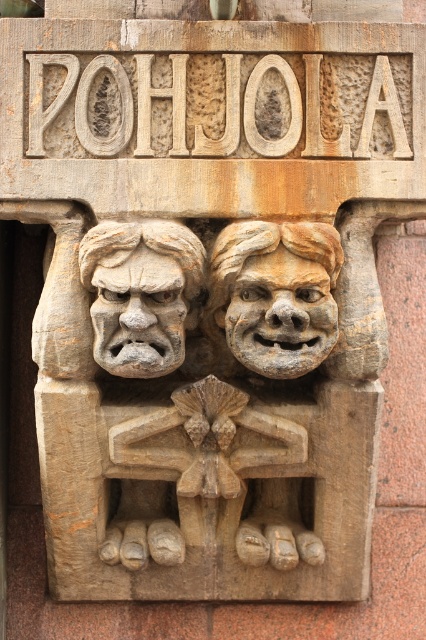
Question: Can you confirm if carved stone face at center is thinner than matte stone face at center?

Choices:
 (A) no
 (B) yes

Answer: (A)

Question: Which point appears closest to the camera in this image?

Choices:
 (A) (34, 140)
 (B) (146, 305)
 (C) (261, 362)

Answer: (B)

Question: Among these objects, which one is nearest to the camera?

Choices:
 (A) carved stone sign at upper center
 (B) carved stone face at center

Answer: (B)

Question: In this image, where is carved stone sign at upper center located relative to carved stone face at center?

Choices:
 (A) right
 (B) left

Answer: (B)

Question: Which point is closer to the camera?

Choices:
 (A) matte stone face at center
 (B) carved stone sign at upper center

Answer: (A)

Question: Can you confirm if carved stone sign at upper center is positioned above carved stone face at center?

Choices:
 (A) yes
 (B) no

Answer: (A)